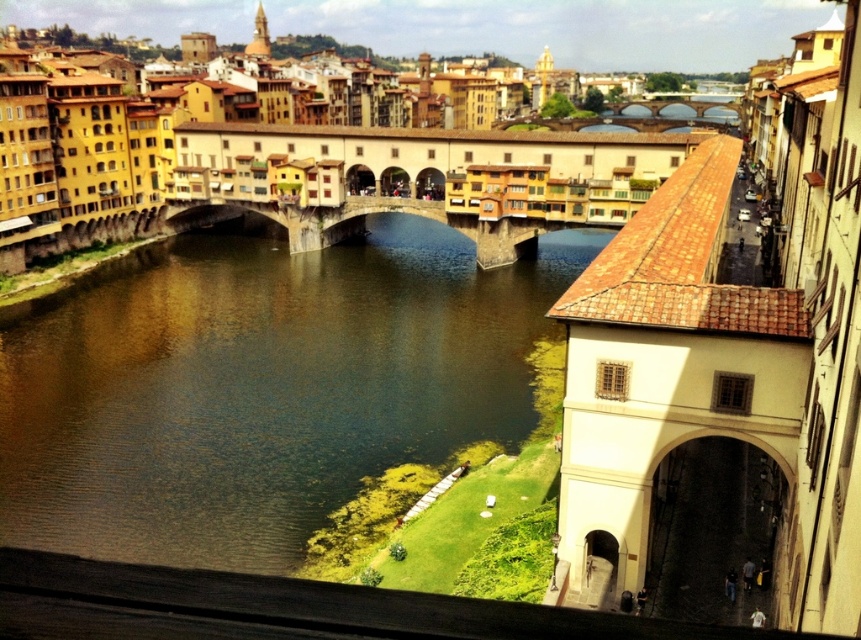
You are standing at the starting point of the pathway in the foreground and want to reach the river. According to the image, in which direction should you move relative to the pathway to reach the brown water at center?

The brown water at center is located at point (259, 387), so you should move towards the center direction relative to the pathway to reach the brown water at center.